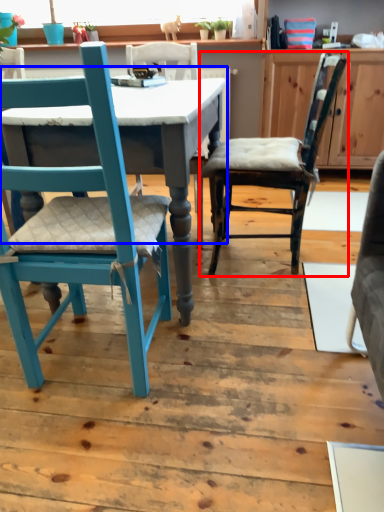
Question: Among these objects, which one is farthest to the camera, chair (highlighted by a red box) or table (highlighted by a blue box)?

Choices:
 (A) chair
 (B) table

Answer: (A)